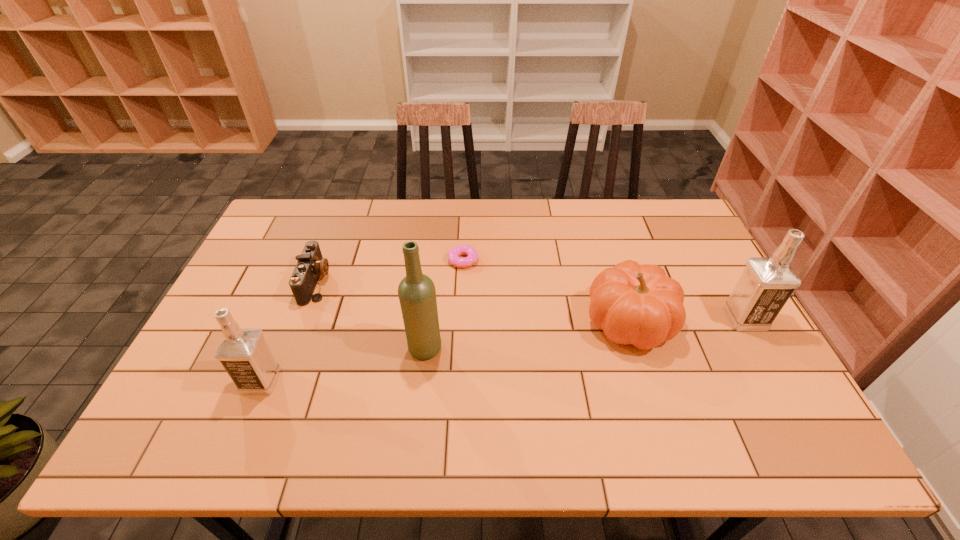
If we want them evenly spaced by inserting an extra vodka among them, please locate a free spot for this new vodka. Please provide its 2D coordinates. Your answer should be formatted as a tuple, i.e. [(x, y)], where the tuple contains the x and y coordinates of a point satisfying the conditions above.

[(518, 347)]